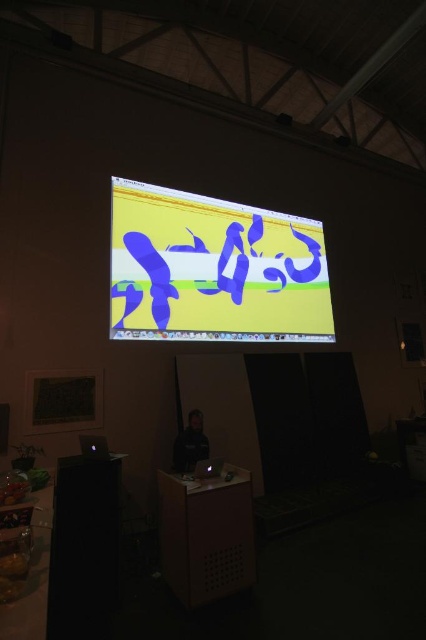
Which is behind, point (175, 461) or point (207, 467)?

Point (175, 461)

You are a GUI agent. You are given a task and a screenshot of the screen. Output one action in this format:
    pyautogui.click(x=<x>, y=<y>)
    Task: Click on the dark fabric jacket at center
    
    Given the screenshot: What is the action you would take?
    pyautogui.click(x=190, y=444)

At what (x,y) coordinates should I click in order to perform the action: click on dark fabric jacket at center. Please return your answer as a coordinate pair (x, y). Looking at the image, I should click on (190, 444).

You are a GUI agent. You are given a task and a screenshot of the screen. Output one action in this format:
    pyautogui.click(x=<x>, y=<y>)
    Task: Click on the dark fabric jacket at center
    
    Given the screenshot: What is the action you would take?
    pyautogui.click(x=190, y=444)

Is point (97, 442) positioned behind point (196, 465)?

No, (97, 442) is in front of (196, 465).

Can you confirm if black glossy laptop at lower left is thinner than matte black laptop at center?

In fact, black glossy laptop at lower left might be wider than matte black laptop at center.

This screenshot has width=426, height=640. What do you see at coordinates (94, 445) in the screenshot?
I see `black glossy laptop at lower left` at bounding box center [94, 445].

Where is `black glossy laptop at lower left`? black glossy laptop at lower left is located at coordinates (94, 445).

Which of these two, matte plastic screen at upper center or dark fabric jacket at center, stands shorter?

With less height is dark fabric jacket at center.

Who is positioned more to the right, matte plastic screen at upper center or dark fabric jacket at center?

matte plastic screen at upper center is more to the right.

Is point (187, 241) behind point (201, 426)?

Yes, point (187, 241) is behind point (201, 426).

You are a GUI agent. You are given a task and a screenshot of the screen. Output one action in this format:
    pyautogui.click(x=<x>, y=<y>)
    Task: Click on the matte plastic screen at upper center
    
    Given the screenshot: What is the action you would take?
    pyautogui.click(x=213, y=269)